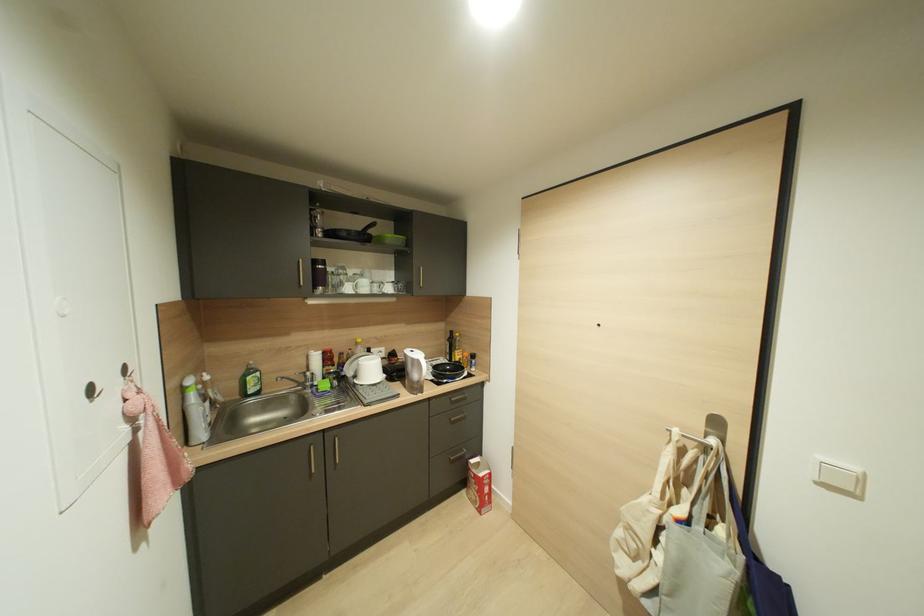
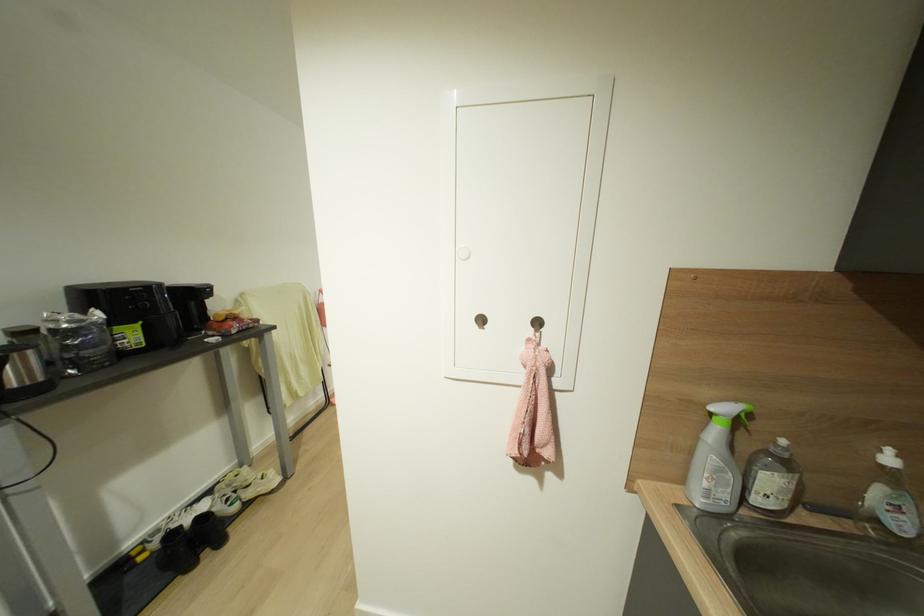
Find the pixel in the second image that matches [183,389] in the first image.

(711, 411)